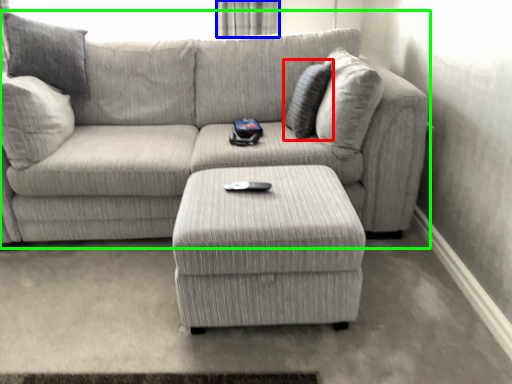
Question: Which object is the farthest from pillow (highlighted by a red box)? Choose among these: curtain (highlighted by a blue box) or studio couch (highlighted by a green box).

Choices:
 (A) curtain
 (B) studio couch

Answer: (A)